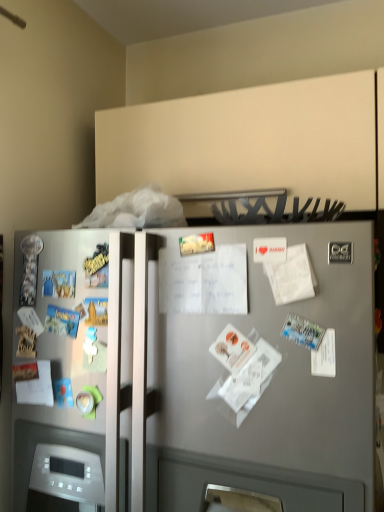
Question: Is the position of white paper at center, which ranks as the second paper in top-to-bottom order, less distant than that of white paper at left, which is counted as the 1th paper, starting from the bottom?

Choices:
 (A) no
 (B) yes

Answer: (B)

Question: Is the position of white paper at center, marked as the first paper in a front-to-back arrangement, more distant than that of white paper at left, which is counted as the 1th paper, starting from the bottom?

Choices:
 (A) no
 (B) yes

Answer: (A)

Question: From the image's perspective, is white paper at center, which is counted as the second paper, starting from the bottom, on white paper at left, arranged as the 3th paper when viewed from the top?

Choices:
 (A) no
 (B) yes

Answer: (B)

Question: Does white paper at center, which ranks as the 2th paper in left-to-right order, have a greater height compared to white paper at left, which is counted as the 1th paper, starting from the bottom?

Choices:
 (A) yes
 (B) no

Answer: (A)

Question: Is white paper at center, the second paper from the right, touching white paper at left, arranged as the 3th paper when viewed from the front?

Choices:
 (A) no
 (B) yes

Answer: (A)

Question: From a real-world perspective, is white paper at center, which appears as the 3th paper when viewed from the back, over white paper at left, marked as the first paper in a left-to-right arrangement?

Choices:
 (A) yes
 (B) no

Answer: (A)

Question: Does white paper at left, marked as the first paper in a left-to-right arrangement, appear on the right side of white paper at center, which ranks as the 2th paper in left-to-right order?

Choices:
 (A) no
 (B) yes

Answer: (A)

Question: Can you confirm if white paper at left, arranged as the 3th paper when viewed from the top, is positioned to the left of white paper at center, marked as the first paper in a front-to-back arrangement?

Choices:
 (A) yes
 (B) no

Answer: (A)

Question: Considering the relative sizes of white paper at left, positioned as the third paper in right-to-left order, and white paper at center, which is counted as the second paper, starting from the bottom, in the image provided, is white paper at left, positioned as the third paper in right-to-left order, smaller than white paper at center, which is counted as the second paper, starting from the bottom,?

Choices:
 (A) yes
 (B) no

Answer: (A)

Question: Considering the relative positions of white paper at left, marked as the first paper in a back-to-front arrangement, and white paper at center, marked as the first paper in a front-to-back arrangement, in the image provided, is white paper at left, marked as the first paper in a back-to-front arrangement, in front of white paper at center, marked as the first paper in a front-to-back arrangement,?

Choices:
 (A) no
 (B) yes

Answer: (A)

Question: Is white paper at left, arranged as the 3th paper when viewed from the front, further to the viewer compared to white paper at center, which is counted as the second paper, starting from the bottom?

Choices:
 (A) no
 (B) yes

Answer: (B)

Question: Is white paper at left, arranged as the 3th paper when viewed from the top, with white paper at center, which is counted as the second paper, starting from the bottom?

Choices:
 (A) no
 (B) yes

Answer: (A)

Question: From the image's perspective, would you say satin silver refrigerator at center is shown under white matte paper at center-right, the 2th paper when ordered from back to front?

Choices:
 (A) yes
 (B) no

Answer: (A)